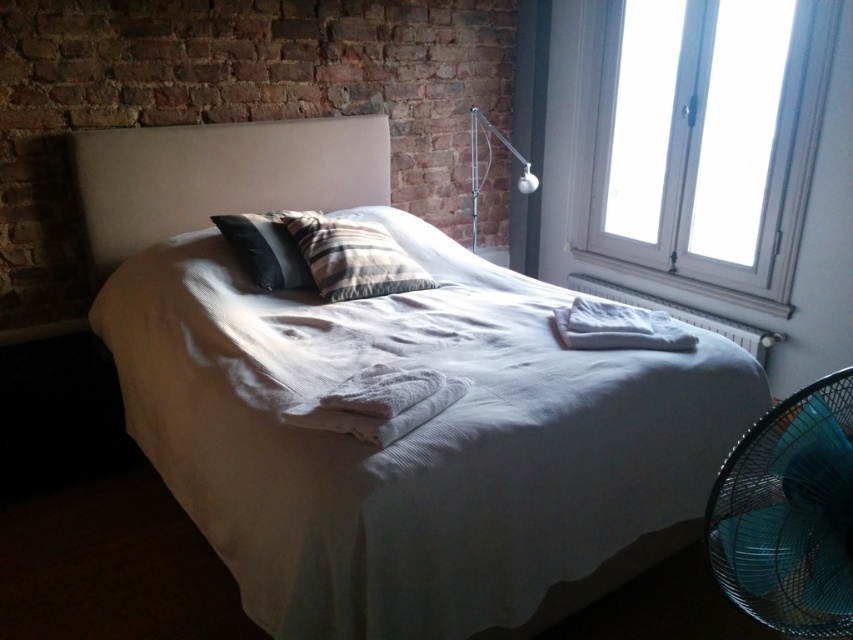
Question: Estimate the real-world distances between objects in this image. Which object is farther from the metallic silver lamp at upper right?

Choices:
 (A) blue metallic fan at lower right
 (B) white cotton bed at center

Answer: (A)

Question: Does white cotton bed at center have a smaller size compared to plaid fabric pillow at center?

Choices:
 (A) no
 (B) yes

Answer: (A)

Question: Estimate the real-world distances between objects in this image. Which object is farther from the metallic silver lamp at upper right?

Choices:
 (A) white fabric headboard at upper center
 (B) plaid fabric pillow at center

Answer: (A)

Question: Which point is closer to the camera?

Choices:
 (A) white plastic window at upper right
 (B) white cotton towels at right

Answer: (B)

Question: Does white plastic window at upper right appear on the right side of white fabric headboard at upper center?

Choices:
 (A) no
 (B) yes

Answer: (B)

Question: Is white cotton towels at right positioned before metallic silver lamp at upper right?

Choices:
 (A) yes
 (B) no

Answer: (A)